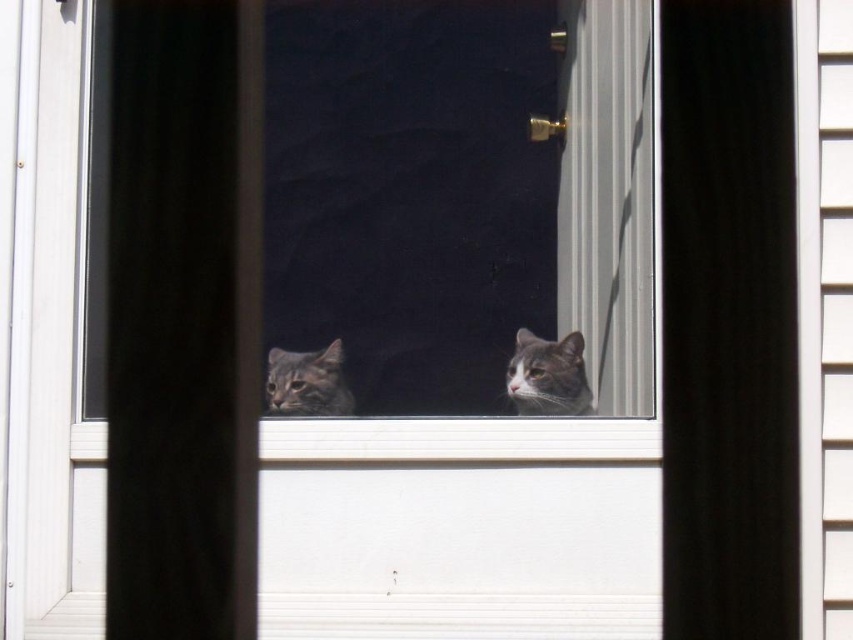
You are a cat owner who wants to place a small toy on the window sill for your cat to play with. Given the current setup of the white plastic window sill at lower center and the gray soft fur cat at center, where should you place the toy so the cat can easily reach it?

The white plastic window sill at lower center is to the left of the gray soft fur cat at center, so placing the toy on the right side of the window sill would position it closer to the cat, making it easier for the gray soft fur cat at center to reach.

From the picture: You are a cat owner who wants to place a small toy on the window sill for your cat to play with. Given the scene, can you safely place the toy on the white plastic window sill at lower center without it being in the way of the tabby fur cat at center?

The white plastic window sill at lower center is closer to the viewer than the tabby fur cat at center, so placing the toy there would keep it within reach of the cat while avoiding obstruction of its current position.

You are a small toy mouse that wants to jump from the white plastic window sill at lower center onto the gray soft fur cat at center. Can you reach the cat from the window sill?

The white plastic window sill at lower center has a lesser height compared to gray soft fur cat at center, so the toy mouse can jump from the window sill onto the cat since the cat is taller.